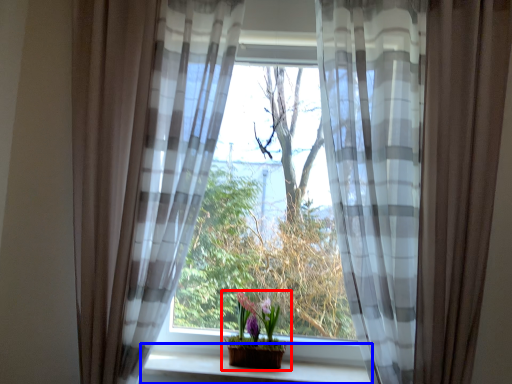
Question: Which object appears closest to the camera in this image, houseplant (highlighted by a red box) or window sill (highlighted by a blue box)?

Choices:
 (A) houseplant
 (B) window sill

Answer: (B)